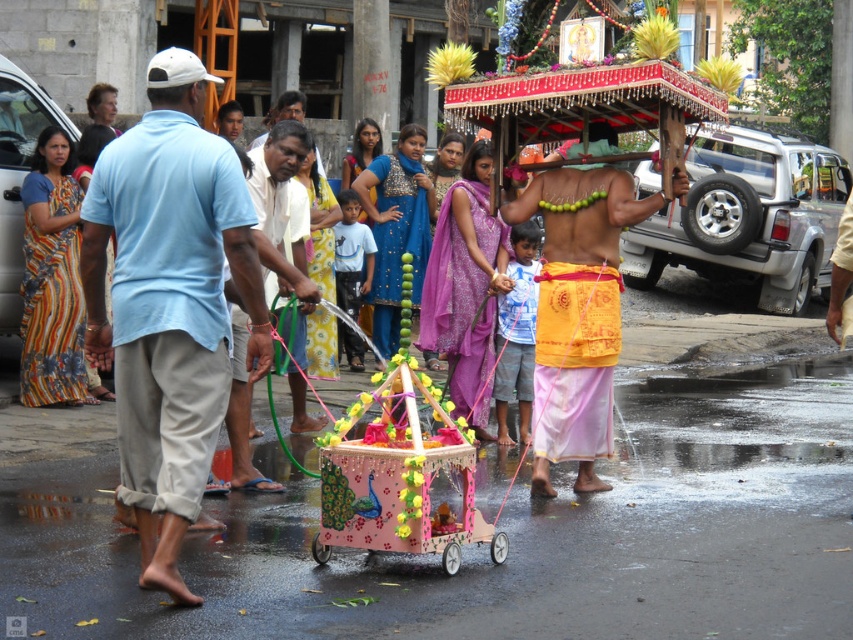
Is yellow fabric cloth at center positioned behind pastel pink wooden cart at center?

Yes, it is.

Identify the location of yellow fabric cloth at center. (577, 314).

Consider the image. Between light blue cotton shirt at left and pastel pink wooden cart at center, which one has more height?

With more height is light blue cotton shirt at left.

Can you confirm if light blue cotton shirt at left is thinner than pastel pink wooden cart at center?

Indeed, light blue cotton shirt at left has a lesser width compared to pastel pink wooden cart at center.

Is point (140, 220) in front of point (422, 388)?

Yes, it is in front of point (422, 388).

The width and height of the screenshot is (853, 640). What are the coordinates of `light blue cotton shirt at left` in the screenshot? It's located at (169, 301).

Is light blue cotton shirt at left above yellow fabric cloth at center?

No.

Is light blue cotton shirt at left positioned behind yellow fabric cloth at center?

No, light blue cotton shirt at left is closer to the viewer.

The width and height of the screenshot is (853, 640). Find the location of `light blue cotton shirt at left`. light blue cotton shirt at left is located at coordinates (169, 301).